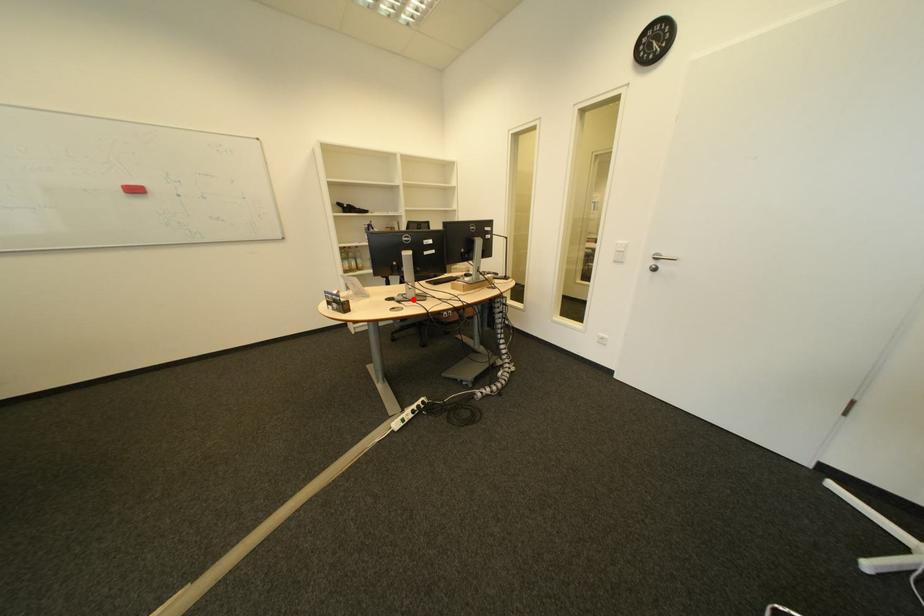
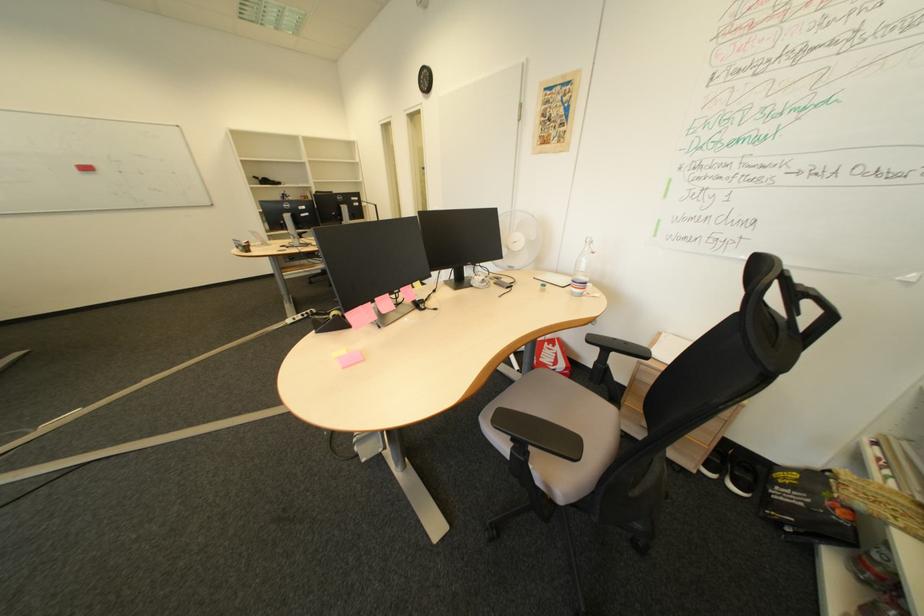
Where in the second image is the point corresponding to the highlighted location from the first image?

(301, 246)